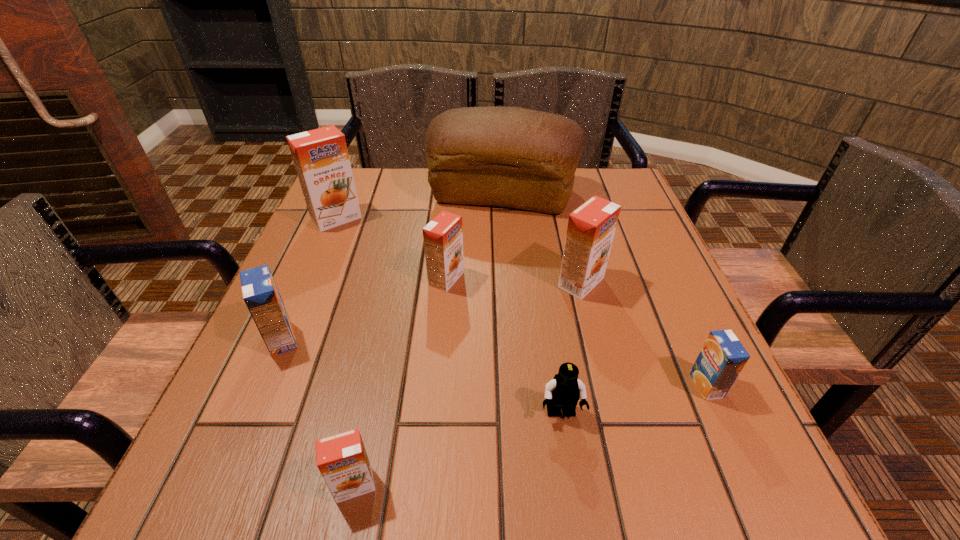
Where is `Lego`? Lego is located at coordinates (564, 390).

Where is `the nearer blue orange_juice`? the nearer blue orange_juice is located at coordinates (722, 357).

In order to click on the third nearest object in this screenshot , I will do `click(722, 357)`.

This screenshot has width=960, height=540. What are the coordinates of `the nearest orange orange juice` in the screenshot? It's located at (342, 460).

You are a GUI agent. You are given a task and a screenshot of the screen. Output one action in this format:
    pyautogui.click(x=<x>, y=<y>)
    Task: Click on the nearest orange juice
    The width and height of the screenshot is (960, 540).
    Given the screenshot: What is the action you would take?
    pyautogui.click(x=342, y=460)

This screenshot has width=960, height=540. I want to click on vacant space positioned 0.380m on the front of the bread, so click(512, 339).

Where is `free region located on the front of the farthest orange orange juice`? This screenshot has height=540, width=960. free region located on the front of the farthest orange orange juice is located at coordinates (287, 335).

You are a GUI agent. You are given a task and a screenshot of the screen. Output one action in this format:
    pyautogui.click(x=<x>, y=<y>)
    Task: Click on the free space located on the left of the fifth shortest orange juice
    The height and width of the screenshot is (540, 960).
    Given the screenshot: What is the action you would take?
    pyautogui.click(x=533, y=282)

I want to click on blank area located 0.290m on the left of the third orange juice from right to left, so click(291, 279).

I want to click on vacant space located 0.100m on the front of the bigger blue orange_juice, so click(252, 408).